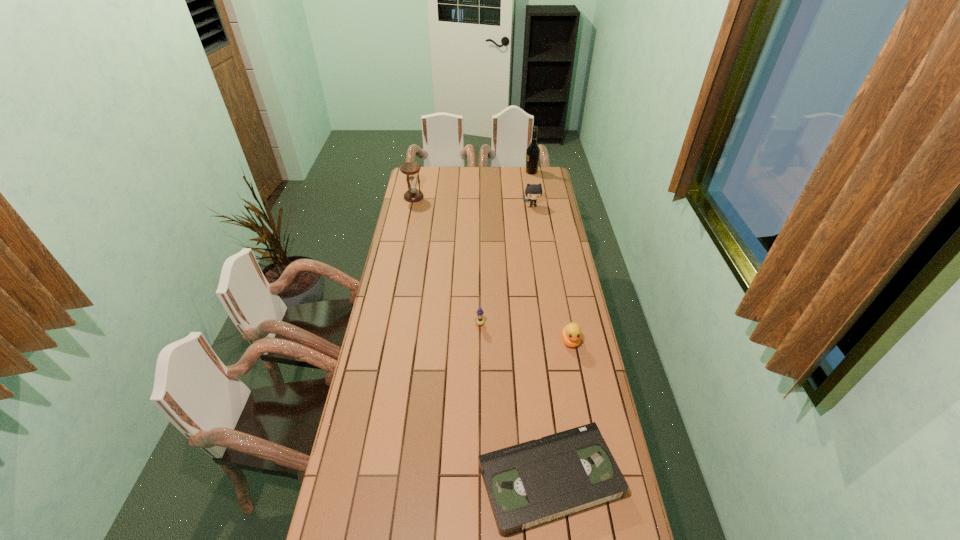
What are the coordinates of `wine bottle` in the screenshot? It's located at (533, 151).

Where is `the farthest object`? the farthest object is located at coordinates (533, 151).

Where is `the leftmost object`? This screenshot has height=540, width=960. the leftmost object is located at coordinates (410, 169).

Identify the location of hourglass. The height and width of the screenshot is (540, 960). (410, 169).

You are a GUI agent. You are given a task and a screenshot of the screen. Output one action in this format:
    pyautogui.click(x=<x>, y=<y>)
    Task: Click on the third tallest object
    Image resolution: width=960 pixels, height=540 pixels.
    Given the screenshot: What is the action you would take?
    pyautogui.click(x=533, y=191)

Locate an element on the screen. The image size is (960, 540). the nearer duckling is located at coordinates (570, 333).

This screenshot has height=540, width=960. I want to click on the right duckling, so click(x=570, y=333).

Image resolution: width=960 pixels, height=540 pixels. In order to click on the left duckling in this screenshot , I will do `click(480, 312)`.

At what (x,y) coordinates should I click in order to perform the action: click on the farther duckling. Please return your answer as a coordinate pair (x, y). Looking at the image, I should click on (480, 312).

You are a GUI agent. You are given a task and a screenshot of the screen. Output one action in this format:
    pyautogui.click(x=<x>, y=<y>)
    Task: Click on the shortest object
    Image resolution: width=960 pixels, height=540 pixels.
    Given the screenshot: What is the action you would take?
    pos(538,481)